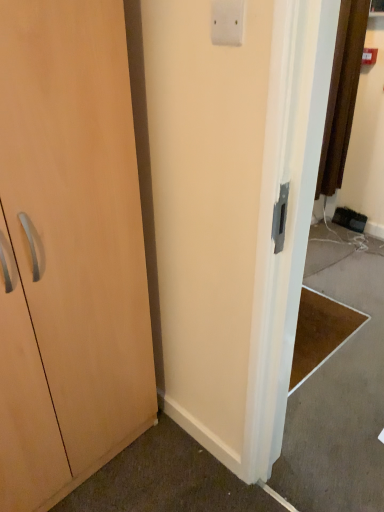
Question: Considering the positions of light wood cabinet at left and white plastic light switch at upper center in the image, is light wood cabinet at left bigger or smaller than white plastic light switch at upper center?

Choices:
 (A) big
 (B) small

Answer: (A)

Question: In the image, is light wood cabinet at left on the left side or the right side of white plastic light switch at upper center?

Choices:
 (A) left
 (B) right

Answer: (A)

Question: From the image's perspective, is light wood cabinet at left located above or below white plastic light switch at upper center?

Choices:
 (A) above
 (B) below

Answer: (B)

Question: Considering the positions of white plastic light switch at upper center and light wood cabinet at left in the image, is white plastic light switch at upper center taller or shorter than light wood cabinet at left?

Choices:
 (A) tall
 (B) short

Answer: (B)

Question: From the image's perspective, is white plastic light switch at upper center above or below light wood cabinet at left?

Choices:
 (A) above
 (B) below

Answer: (A)

Question: In the image, is white plastic light switch at upper center positioned in front of or behind light wood cabinet at left?

Choices:
 (A) front
 (B) behind

Answer: (B)

Question: Is white plastic light switch at upper center wider or thinner than light wood cabinet at left?

Choices:
 (A) thin
 (B) wide

Answer: (A)